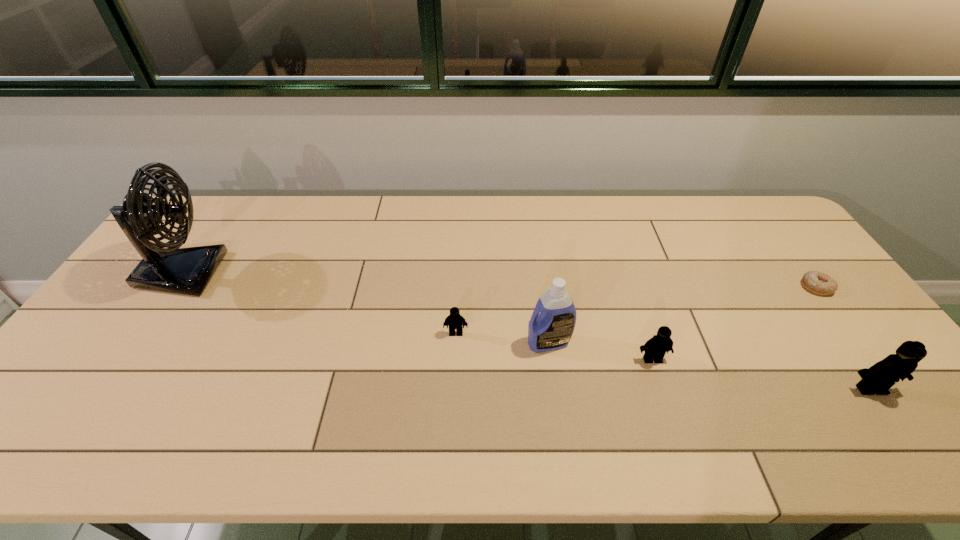
The height and width of the screenshot is (540, 960). I want to click on free space between the shortest Lego and the doughnut, so click(636, 310).

Locate an element on the screen. This screenshot has width=960, height=540. empty space between the second object from left to right and the fourth object from right to left is located at coordinates (502, 338).

At what (x,y) coordinates should I click in order to perform the action: click on vacant area that lies between the nearest object and the fourth tallest object. Please return your answer as a coordinate pair (x, y). Looking at the image, I should click on (761, 374).

Where is `free space that is in between the fan and the second nearest object`? free space that is in between the fan and the second nearest object is located at coordinates (418, 316).

Identify the location of free area in between the third tallest object and the fourth object from right to left. Image resolution: width=960 pixels, height=540 pixels. (709, 366).

Where is `free spot between the fan and the fifth tallest object`? This screenshot has height=540, width=960. free spot between the fan and the fifth tallest object is located at coordinates (319, 303).

What are the coordinates of `object that is the fourth closest to the second Lego from left to right` in the screenshot? It's located at (816, 282).

Locate an element on the screen. The height and width of the screenshot is (540, 960). the third closest object to the fan is located at coordinates (655, 348).

Identify which Lego is the second closest to the doughnut. Please provide its 2D coordinates. Your answer should be formatted as a tuple, i.e. [(x, y)], where the tuple contains the x and y coordinates of a point satisfying the conditions above.

[(655, 348)]

Locate which Lego ranks in proximity to the second tallest Lego. Please provide its 2D coordinates. Your answer should be formatted as a tuple, i.e. [(x, y)], where the tuple contains the x and y coordinates of a point satisfying the conditions above.

[(878, 379)]